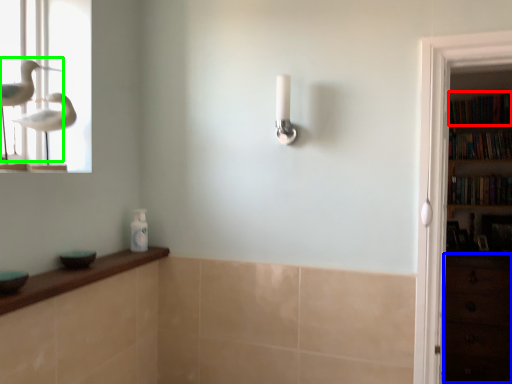
Question: Based on their relative distances, which object is farther from book (highlighted by a red box)? Choose from drawer (highlighted by a blue box) and bird (highlighted by a green box).

Choices:
 (A) drawer
 (B) bird

Answer: (B)